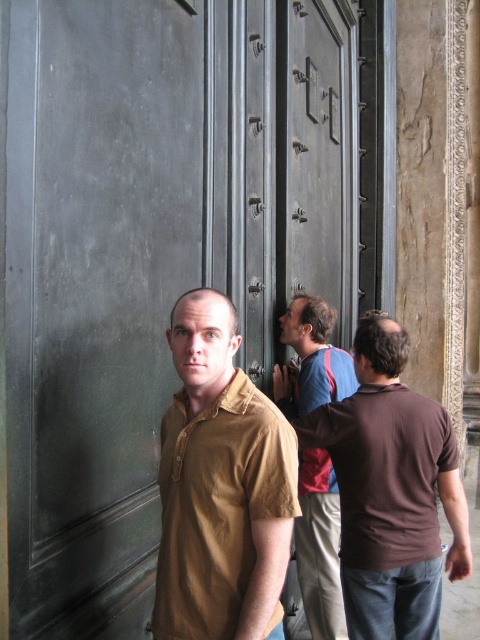
Question: Does brown cotton shirt at center have a greater width compared to blue striped shirt at center?

Choices:
 (A) no
 (B) yes

Answer: (A)

Question: Which point is farther to the camera?

Choices:
 (A) (322, 365)
 (B) (440, 465)
 (C) (277, 618)

Answer: (A)

Question: Among these objects, which one is nearest to the camera?

Choices:
 (A) blue striped shirt at center
 (B) brown cotton shirt at right

Answer: (B)

Question: Which object appears farthest from the camera in this image?

Choices:
 (A) blue striped shirt at center
 (B) brown cotton shirt at center
 (C) brown cotton shirt at right

Answer: (A)

Question: Can you confirm if brown cotton shirt at right is thinner than blue striped shirt at center?

Choices:
 (A) no
 (B) yes

Answer: (A)

Question: Can you confirm if brown cotton shirt at center is bigger than blue striped shirt at center?

Choices:
 (A) yes
 (B) no

Answer: (A)